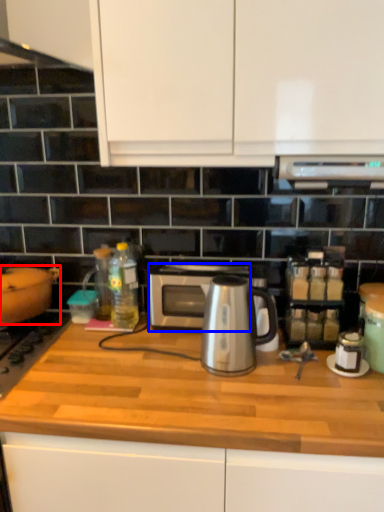
Question: Among these objects, which one is nearest to the camera, kitchen appliance (highlighted by a red box) or microwave oven (highlighted by a blue box)?

Choices:
 (A) kitchen appliance
 (B) microwave oven

Answer: (A)